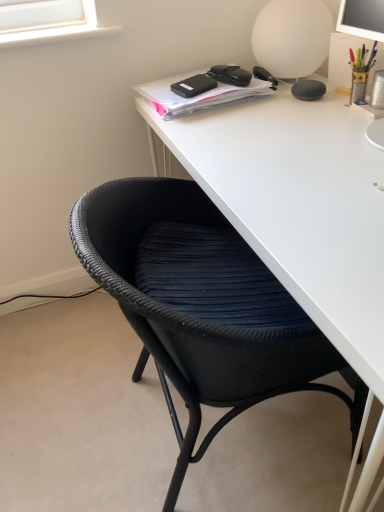
Where is `vacant space in between matte black speaker at upper right, placed as the 3th stationery when sorted from left to right, and metallic gold pen holder at upper right, which is the first stationery in right-to-left order`? vacant space in between matte black speaker at upper right, placed as the 3th stationery when sorted from left to right, and metallic gold pen holder at upper right, which is the first stationery in right-to-left order is located at coordinates (327, 102).